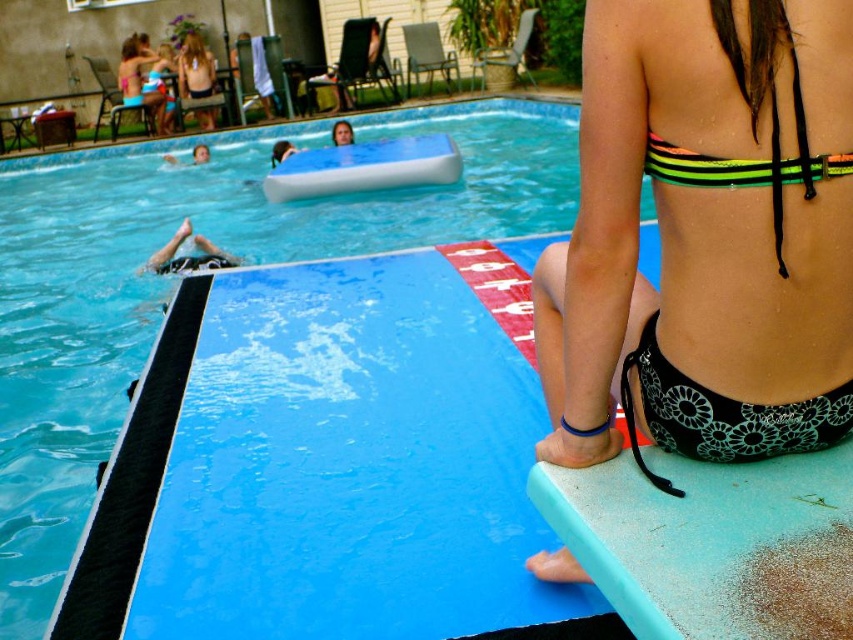
Question: Which of the following is the farthest from the observer?

Choices:
 (A) neon green bikini top at upper right
 (B) blue rubber pool at upper center
 (C) black floral bikini at lower right

Answer: (B)

Question: Which object is the closest to the blue rubber pool at upper center?

Choices:
 (A) black floral bikini at lower right
 (B) black rubber swim cap at left
 (C) neon green bikini top at upper right

Answer: (B)

Question: Does blue rubber pool at upper center appear on the right side of black floral bikini at lower right?

Choices:
 (A) no
 (B) yes

Answer: (A)

Question: Can you confirm if blue rubber pool at upper center is bigger than black floral bikini at lower right?

Choices:
 (A) no
 (B) yes

Answer: (B)

Question: Can you confirm if neon green bikini top at upper right is thinner than neon green/yellow striped bikini top at upper right?

Choices:
 (A) no
 (B) yes

Answer: (A)

Question: Which point is farther to the camera?

Choices:
 (A) black floral bikini at lower right
 (B) neon green bikini top at upper right
 (C) black rubber swim cap at left
 (D) neon green/yellow striped bikini top at upper right

Answer: (C)